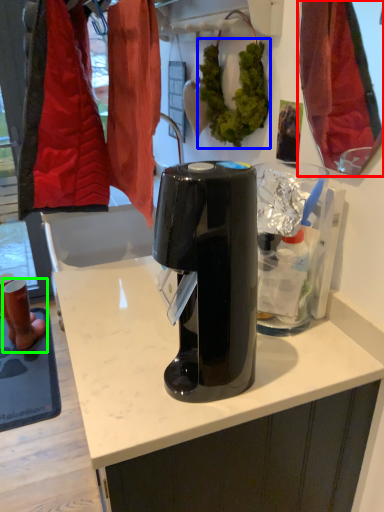
Question: Estimate the real-world distances between objects in this image. Which object is farther from mirror (highlighted by a red box), plant (highlighted by a blue box) or footwear (highlighted by a green box)?

Choices:
 (A) plant
 (B) footwear

Answer: (B)